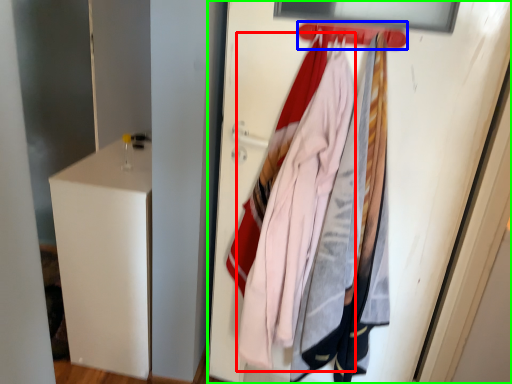
Question: Which is farther away from clothing (highlighted by a red box)? hanger (highlighted by a blue box) or door (highlighted by a green box)?

Choices:
 (A) hanger
 (B) door

Answer: (A)